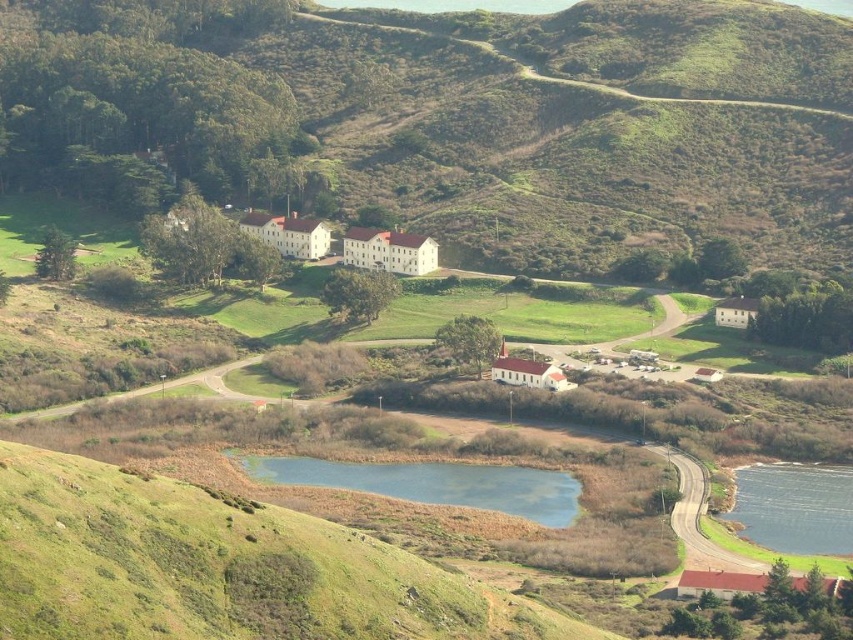
Based on the photo, you are standing at the pond in the foreground of the rural landscape scene. You notice two points marked in the image. The first point is at coordinate point (x=432, y=470) and the second is at point (x=791, y=518). If you were to walk towards the first point, would you pass by the second point before reaching it?

Point (x=432, y=470) is behind point (x=791, y=518). Therefore, walking towards the first point, you would pass by the second point (x=791, y=518) first before reaching the first point.

You are planning to take a photo of the green grassy hill at upper center and the blue grassy lake at center. Which object will occupy more horizontal space in your photo?

The green grassy hill at upper center will occupy more horizontal space in the photo since its width surpasses that of the blue grassy lake at center.